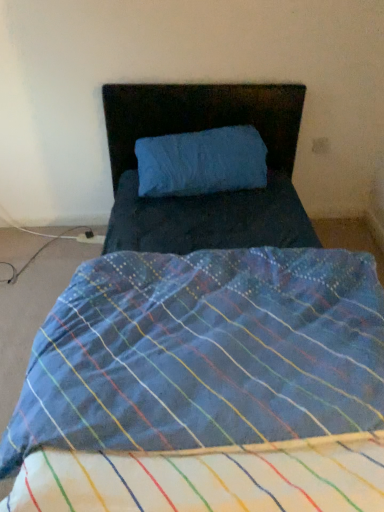
Question: Should I look upward or downward to see blue fabric pillow at center?

Choices:
 (A) down
 (B) up

Answer: (B)